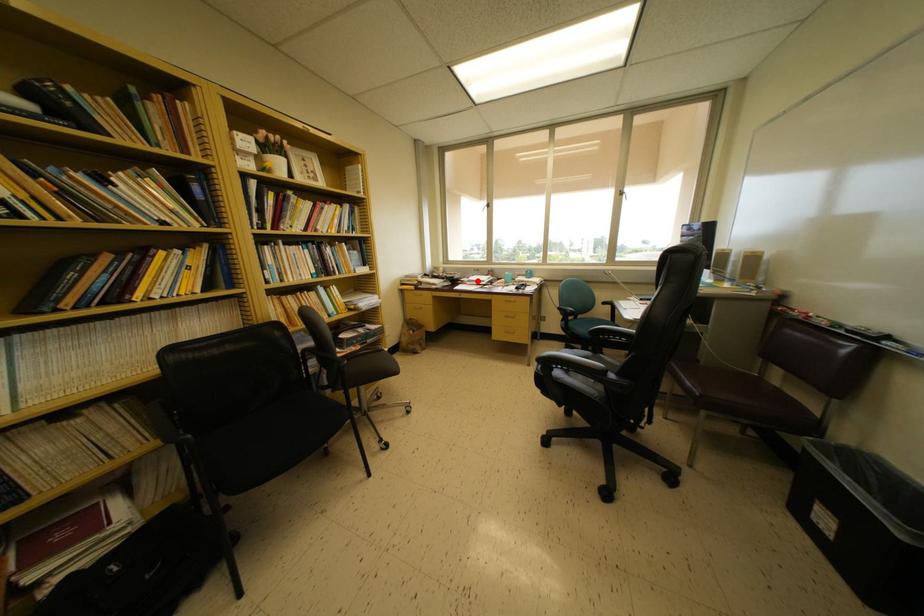
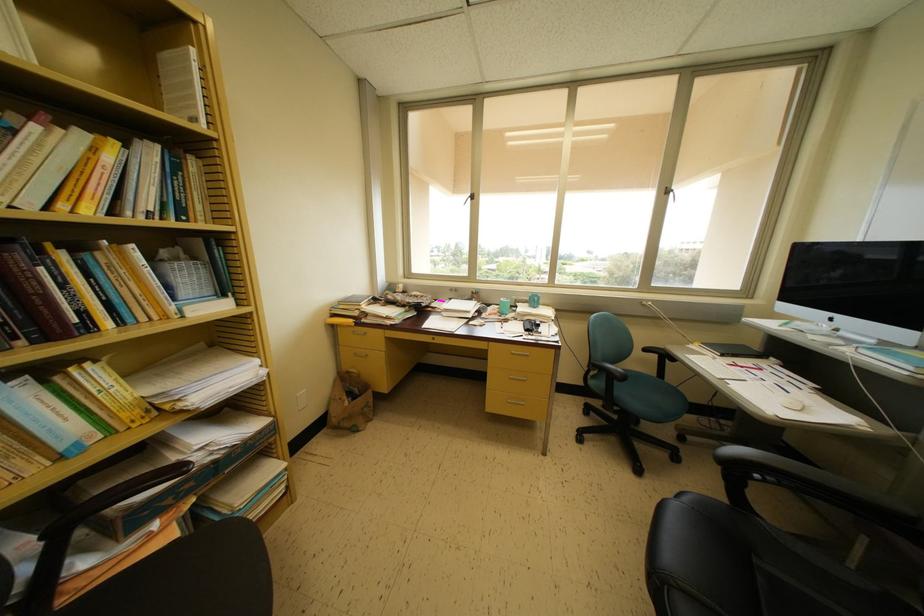
Find the pixel in the second image that matches the highlighted location in the first image.

(455, 304)